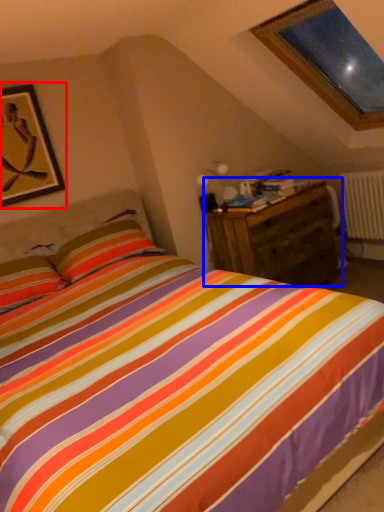
Question: Which point is closer to the camera, picture frame (highlighted by a red box) or nightstand (highlighted by a blue box)?

Choices:
 (A) picture frame
 (B) nightstand

Answer: (A)